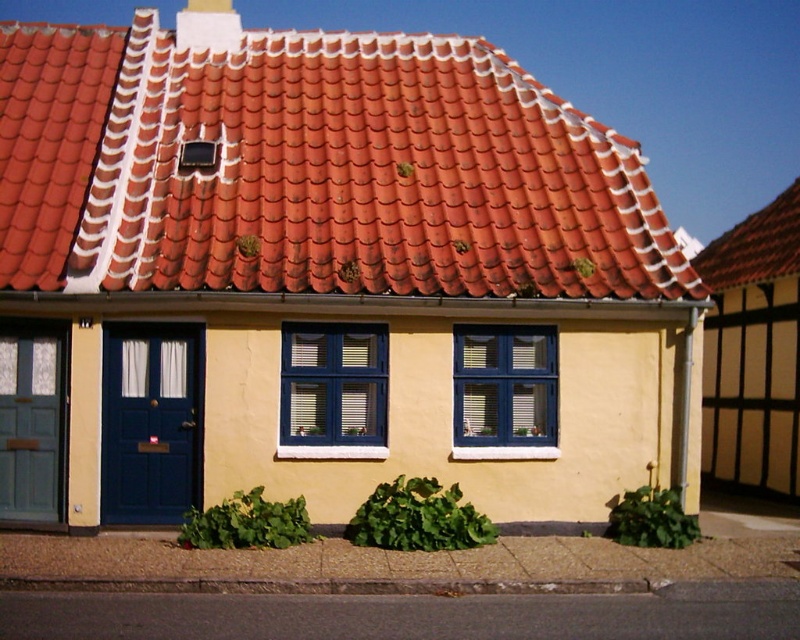
Can you confirm if matte blue door at lower left is shorter than teal wooden door at left?

In fact, matte blue door at lower left may be taller than teal wooden door at left.

Does matte blue door at lower left have a lesser width compared to teal wooden door at left?

Incorrect, matte blue door at lower left's width is not less than teal wooden door at left's.

The height and width of the screenshot is (640, 800). Identify the location of matte blue door at lower left. (150, 422).

Find the location of a particular element. matte blue door at lower left is located at coordinates (150, 422).

Between point (141, 161) and point (20, 404), which one is positioned in front?

Point (20, 404)

Is red clay tiles at upper center to the right of teal wooden door at left from the viewer's perspective?

Correct, you'll find red clay tiles at upper center to the right of teal wooden door at left.

Locate an element on the screen. red clay tiles at upper center is located at coordinates (314, 170).

Based on the photo, can you confirm if red clay tiles at upper center is wider than matte blue door at lower left?

Indeed, red clay tiles at upper center has a greater width compared to matte blue door at lower left.

Between point (378, 192) and point (200, 365), which one is positioned behind?

The point (378, 192) is behind.

Does point (492, 205) come closer to viewer compared to point (200, 372)?

That is False.

Locate an element on the screen. red clay tiles at upper center is located at coordinates (314, 170).